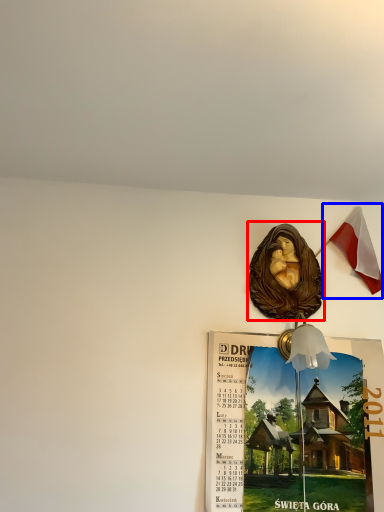
Question: Which object is closer to the camera taking this photo, art (highlighted by a red box) or national flag (highlighted by a blue box)?

Choices:
 (A) art
 (B) national flag

Answer: (A)